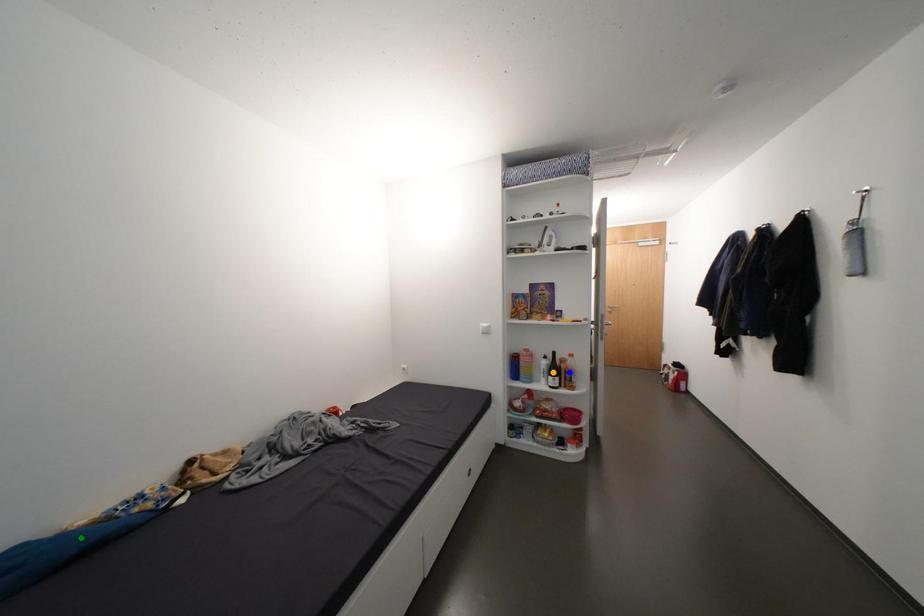
Order these from nearest to farthest:
- blue point
- orange point
- green point

green point → blue point → orange point